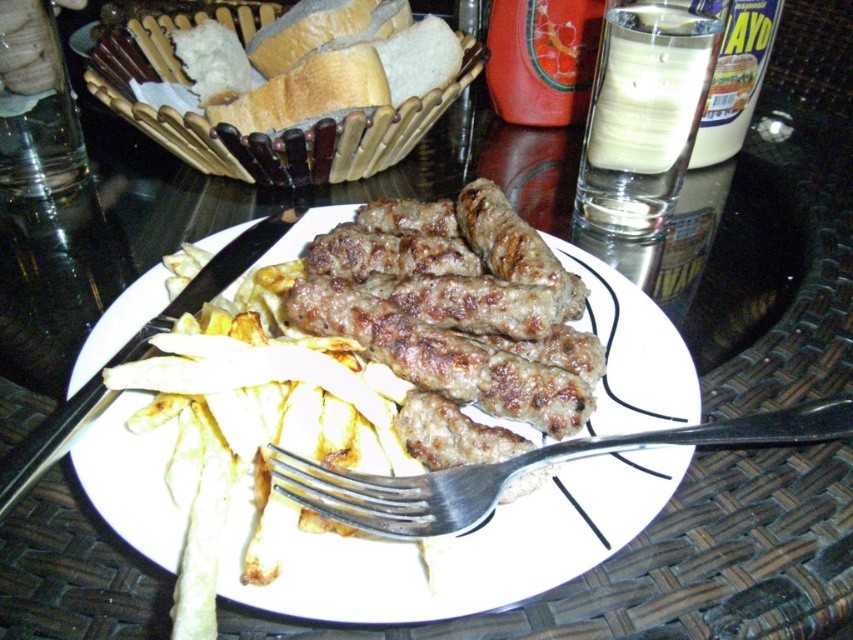
Question: Which object is farther from the camera taking this photo?

Choices:
 (A) clear glass at upper right
 (B) silver metallic fork at plate center
 (C) golden crispy fries at center

Answer: (A)

Question: Does white matte plate at center appear over clear glass at upper right?

Choices:
 (A) no
 (B) yes

Answer: (A)

Question: Can you confirm if clear glass at upper right is positioned to the right of bread basket at upper left?

Choices:
 (A) no
 (B) yes

Answer: (B)

Question: Which of these objects is positioned closest to the bread basket at upper left?

Choices:
 (A) white matte plate at center
 (B) golden crispy fries at center

Answer: (A)

Question: Which object appears closest to the camera in this image?

Choices:
 (A) bread basket at upper left
 (B) golden crispy fries at center

Answer: (B)

Question: Does clear glass at upper right appear over bread basket at upper left?

Choices:
 (A) yes
 (B) no

Answer: (B)